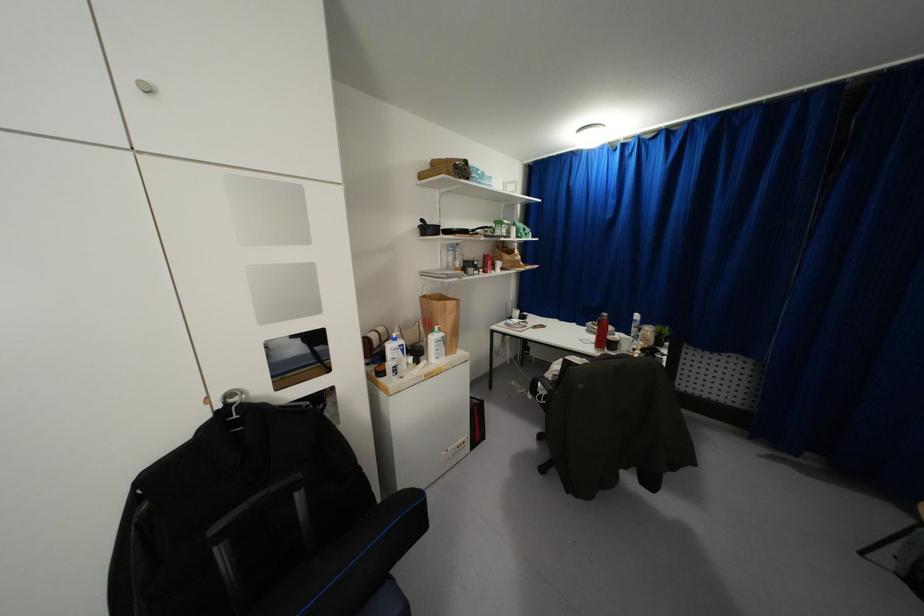
Where is `chair armrest`? The width and height of the screenshot is (924, 616). chair armrest is located at coordinates (543, 387).